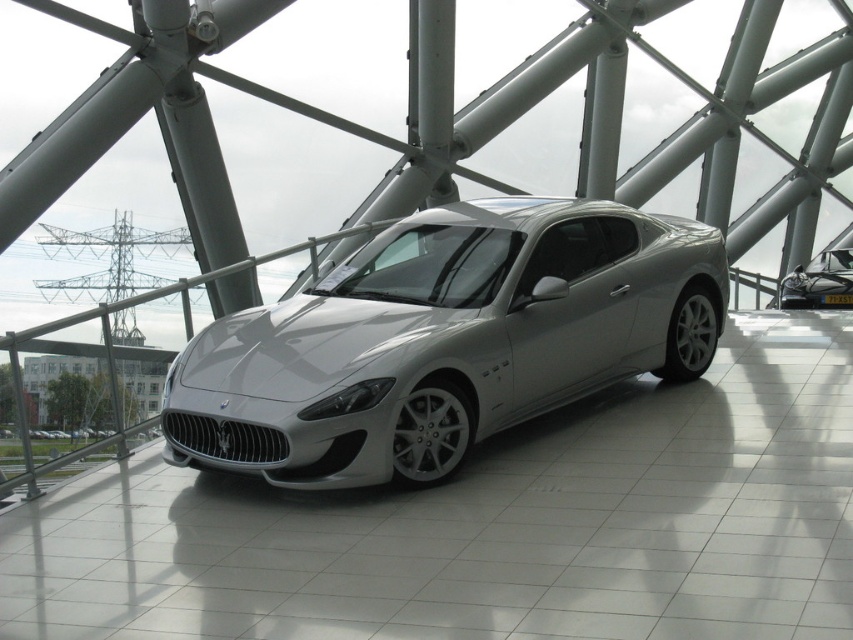
Question: Which point is closer to the camera taking this photo?

Choices:
 (A) (851, 288)
 (B) (300, 360)

Answer: (B)

Question: Which of the following is the closest to the observer?

Choices:
 (A) satin silver car at center
 (B) sleek silver car at center

Answer: (B)

Question: Which of the following is the farthest from the observer?

Choices:
 (A) sleek silver car at center
 (B) satin silver car at center

Answer: (B)

Question: Is sleek silver car at center positioned before satin silver car at center?

Choices:
 (A) yes
 (B) no

Answer: (A)

Question: Is sleek silver car at center smaller than satin silver car at center?

Choices:
 (A) no
 (B) yes

Answer: (A)

Question: Is sleek silver car at center smaller than satin silver car at center?

Choices:
 (A) yes
 (B) no

Answer: (B)